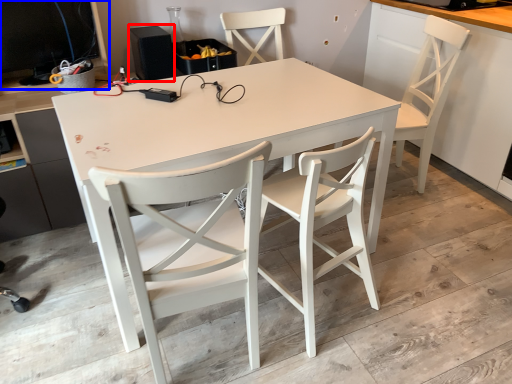
Question: Which object is further to the camera taking this photo, speaker (highlighted by a red box) or desktop computer (highlighted by a blue box)?

Choices:
 (A) speaker
 (B) desktop computer

Answer: (A)